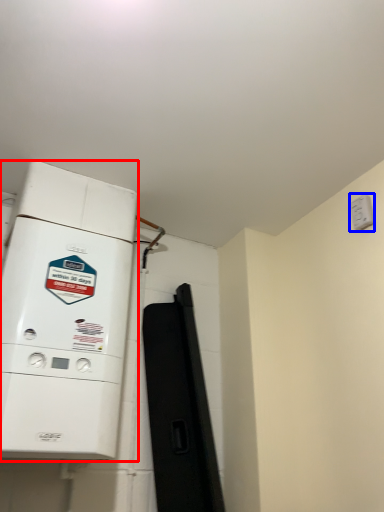
Question: Which point is further to the camera, home appliance (highlighted by a red box) or electric outlet (highlighted by a blue box)?

Choices:
 (A) home appliance
 (B) electric outlet

Answer: (B)